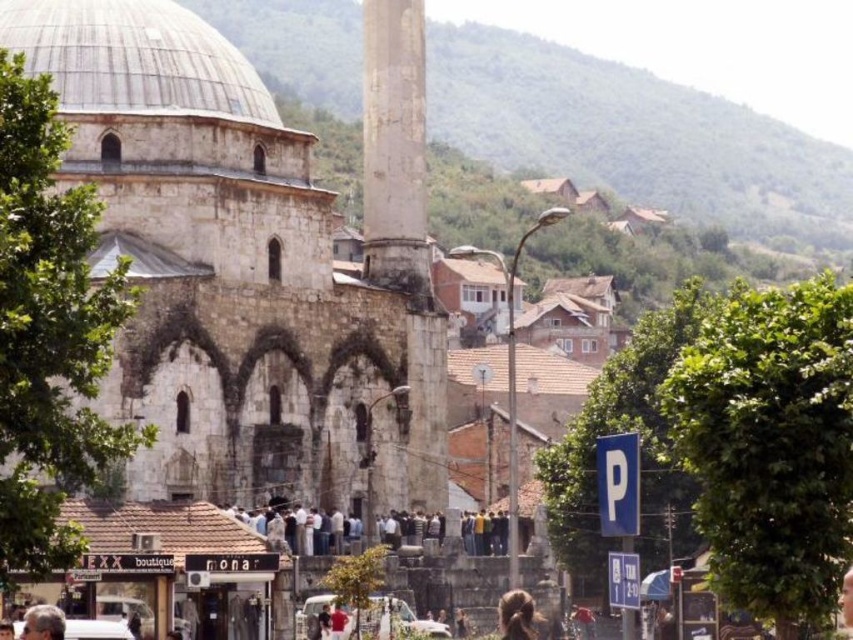
Question: Among these points, which one is farthest from the camera?

Choices:
 (A) (270, 516)
 (B) (403, 138)
 (C) (532, 609)

Answer: (B)

Question: Does dark gray stone people at center lie in front of brown fuzzy hair at lower center?

Choices:
 (A) no
 (B) yes

Answer: (A)

Question: Which object is positioned farthest from the brown fuzzy hair at lower center?

Choices:
 (A) dark gray stone people at center
 (B) gray stone minaret at center
 (C) gray stone dome at upper center

Answer: (C)

Question: Can you confirm if dark gray stone people at center is positioned below brown fuzzy hair at lower center?

Choices:
 (A) yes
 (B) no

Answer: (B)

Question: Among these objects, which one is farthest from the camera?

Choices:
 (A) dark gray stone people at center
 (B) gray stone minaret at center
 (C) gray stone dome at upper center
 (D) brown fuzzy hair at lower center

Answer: (B)

Question: Does gray stone minaret at center have a lesser width compared to brown fuzzy hair at lower center?

Choices:
 (A) no
 (B) yes

Answer: (A)